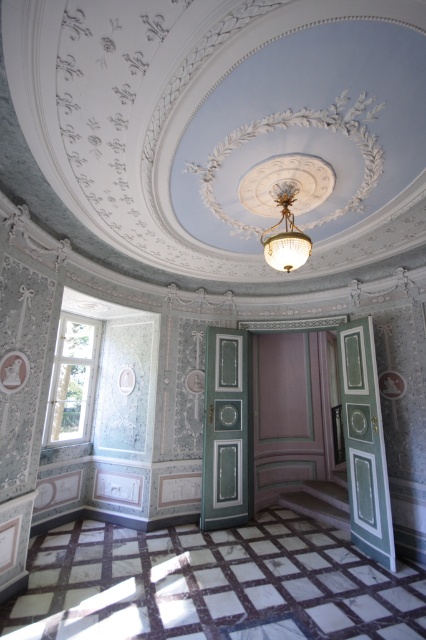
You are standing in the room and want to exit through the highest door. Which door should you choose between the green painted wood door at right and the green glossy door at center?

The green painted wood door at right is located above the green glossy door at center, so you should choose the green painted wood door at right as the highest door.

Consider the image. You are standing in the room and want to exit through the door on the right. Which door should you choose between the green painted wood door at right and the green glossy door at center?

The green painted wood door at right is positioned on the right side of the green glossy door at center, so you should choose the green painted wood door at right to exit through the door on the right.